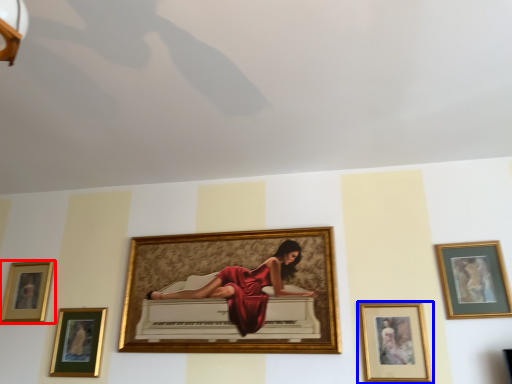
Question: Among these objects, which one is farthest to the camera, picture frame (highlighted by a red box) or picture frame (highlighted by a blue box)?

Choices:
 (A) picture frame
 (B) picture frame

Answer: (A)